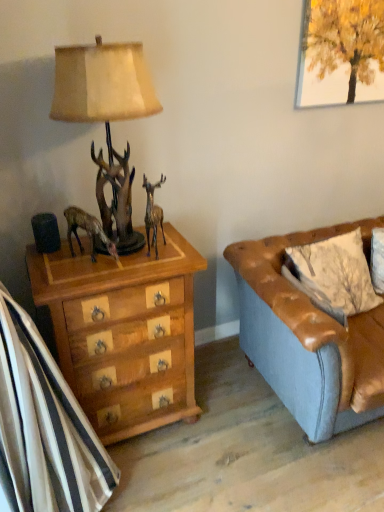
Question: Can you confirm if wooden chest of drawers at left is bigger than antique brown statue at left?

Choices:
 (A) no
 (B) yes

Answer: (B)

Question: Considering the relative sizes of wooden chest of drawers at left and antique brown statue at left in the image provided, is wooden chest of drawers at left smaller than antique brown statue at left?

Choices:
 (A) yes
 (B) no

Answer: (B)

Question: Is wooden chest of drawers at left further to the viewer compared to antique brown statue at left?

Choices:
 (A) no
 (B) yes

Answer: (A)

Question: Is wooden chest of drawers at left located outside antique brown statue at left?

Choices:
 (A) yes
 (B) no

Answer: (A)

Question: Is the surface of wooden chest of drawers at left in direct contact with antique brown statue at left?

Choices:
 (A) yes
 (B) no

Answer: (B)

Question: Considering the positions of point [102, 230] and point [332, 281], is point [102, 230] closer or farther from the camera than point [332, 281]?

Choices:
 (A) farther
 (B) closer

Answer: (B)

Question: From the image's perspective, is antique brown statue at left located above or below leather pillow at right?

Choices:
 (A) above
 (B) below

Answer: (A)

Question: Would you say antique brown statue at left is inside or outside leather pillow at right?

Choices:
 (A) outside
 (B) inside

Answer: (A)

Question: Visually, is antique brown statue at left positioned to the left or to the right of leather pillow at right?

Choices:
 (A) left
 (B) right

Answer: (A)

Question: Considering the positions of point (246, 323) and point (337, 313), is point (246, 323) closer or farther from the camera than point (337, 313)?

Choices:
 (A) farther
 (B) closer

Answer: (A)

Question: From their relative heights in the image, would you say brown leather couch at right is taller or shorter than leather pillow at right?

Choices:
 (A) short
 (B) tall

Answer: (B)

Question: Looking at their shapes, would you say brown leather couch at right is wider or thinner than leather pillow at right?

Choices:
 (A) thin
 (B) wide

Answer: (B)

Question: Is brown leather couch at right in front of or behind leather pillow at right in the image?

Choices:
 (A) front
 (B) behind

Answer: (A)

Question: Is leather pillow at right wider or thinner than metallic gold reindeer at center?

Choices:
 (A) thin
 (B) wide

Answer: (B)

Question: Is point (337, 300) closer or farther from the camera than point (162, 216)?

Choices:
 (A) farther
 (B) closer

Answer: (B)